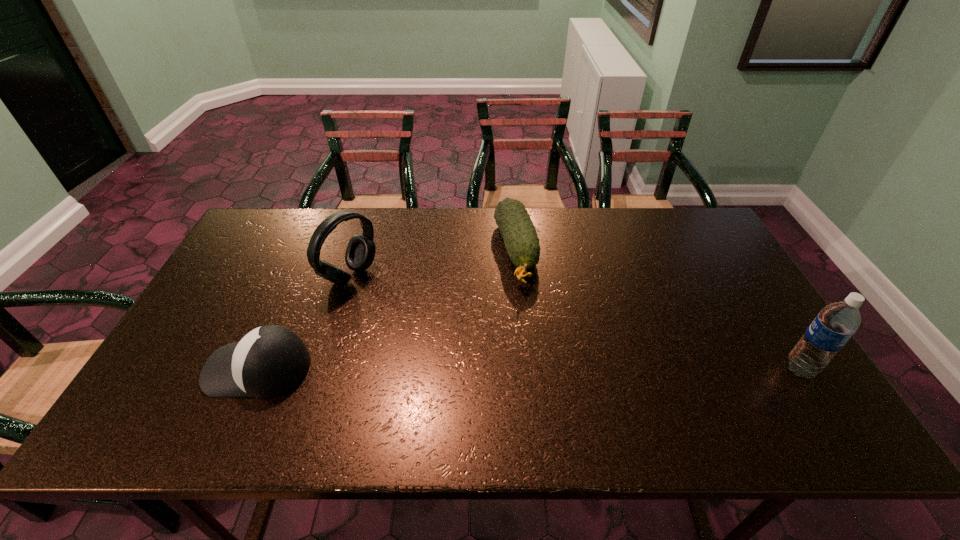
Locate an element on the screen. This screenshot has height=540, width=960. cap is located at coordinates (270, 360).

The image size is (960, 540). Identify the location of water bottle. (836, 323).

Where is `the tallest object`? the tallest object is located at coordinates (836, 323).

Identify the location of the third object from left to right. (520, 237).

The height and width of the screenshot is (540, 960). What are the coordinates of `headset` in the screenshot? It's located at (361, 249).

The image size is (960, 540). Identify the location of vacant space located on the left of the tallest object. (662, 369).

The height and width of the screenshot is (540, 960). I want to click on free space located 0.080m at the blossom end of the cucumber, so click(529, 314).

This screenshot has height=540, width=960. Find the location of `vacant space positioned at the blossom end of the cucumber`. vacant space positioned at the blossom end of the cucumber is located at coordinates (538, 345).

Image resolution: width=960 pixels, height=540 pixels. In order to click on free spot located 0.210m at the blossom end of the cucumber in this screenshot , I will do (x=540, y=351).

Where is `vacant area situated 0.180m on the earcups of the headset`? This screenshot has height=540, width=960. vacant area situated 0.180m on the earcups of the headset is located at coordinates (416, 315).